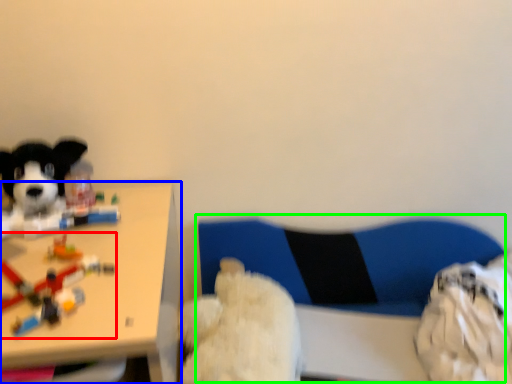
Question: Which object is the closest to the toy (highlighted by a red box)? Choose among these: table (highlighted by a blue box) or swivel chair (highlighted by a green box).

Choices:
 (A) table
 (B) swivel chair

Answer: (A)